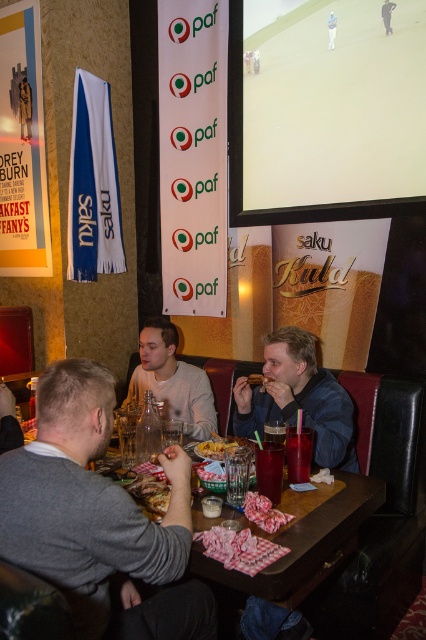
You are standing in the sports bar and want to reach a specific point on the table to grab a napkin. The point is located at coordinates point (95, 602). Considering your height, which is 5.5 feet, will you be able to comfortably reach that point without moving your feet?

The distance between you and point (95, 602) is 3.69 feet. Since the average comfortable reaching distance for someone 5.5 feet tall is about 2.5 feet, you would need to lean forward or take a step to comfortably reach it.

From the picture: You are sitting at the table in the sports bar and need to place your phone on the table. There are two spots available at coordinates point (60, 548) and point (158, 339). Which coordinate is closer to you?

The point (60, 548) is in front of point (158, 339), so placing your phone there would be closer to you.

You are standing at the entrance of the sports bar and want to find the table where the person wearing the gray sweater at center is sitting. According to the coordinates provided, in which direction should you walk from the entrance to reach their table?

The gray sweater at center is located at point 0.809 on the x and 0.230 on the y. Since the entrance is typically at the front, which would be the lower part of the image, you should walk towards the upper right direction to reach the coordinates of the gray sweater at center.